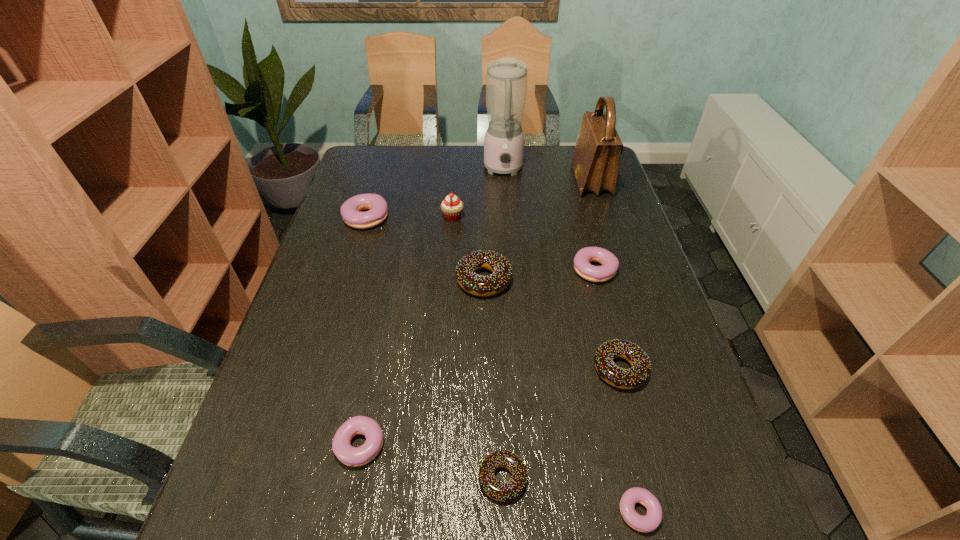
The image size is (960, 540). What are the coordinates of `vacant area that lies between the nearest purple doughnut and the second smallest purple doughnut` in the screenshot? It's located at (502, 476).

You are a GUI agent. You are given a task and a screenshot of the screen. Output one action in this format:
    pyautogui.click(x=<x>, y=<y>)
    Task: Click on the unoccupied position between the fourth nearest object and the nearest chocolate doughnut
    Image resolution: width=960 pixels, height=540 pixels.
    Given the screenshot: What is the action you would take?
    pyautogui.click(x=562, y=424)

Identify the location of free space between the leftmost purple doughnut and the nearest chocolate doughnut. (434, 349).

In order to click on free spot between the smallest chocolate doughnut and the third farthest purple doughnut in this screenshot , I will do `click(434, 462)`.

Find the location of a particular element. This screenshot has width=960, height=540. free space that is in between the biggest chocolate doughnut and the third nearest purple doughnut is located at coordinates (540, 276).

Locate an element on the screen. This screenshot has width=960, height=540. empty space that is in between the nearest chocolate doughnut and the leftmost purple doughnut is located at coordinates (434, 349).

Locate an element on the screen. free spot between the food processor and the third purple doughnut from right to left is located at coordinates point(435,307).

I want to click on object that is the fourth nearest to the tallest object, so click(x=610, y=263).

Locate an element on the screen. The width and height of the screenshot is (960, 540). object that stands as the closest to the ninth shortest object is located at coordinates (506, 81).

Locate which doughnut is the second closest to the food processor. Please provide its 2D coordinates. Your answer should be formatted as a tuple, i.e. [(x, y)], where the tuple contains the x and y coordinates of a point satisfying the conditions above.

[(610, 263)]